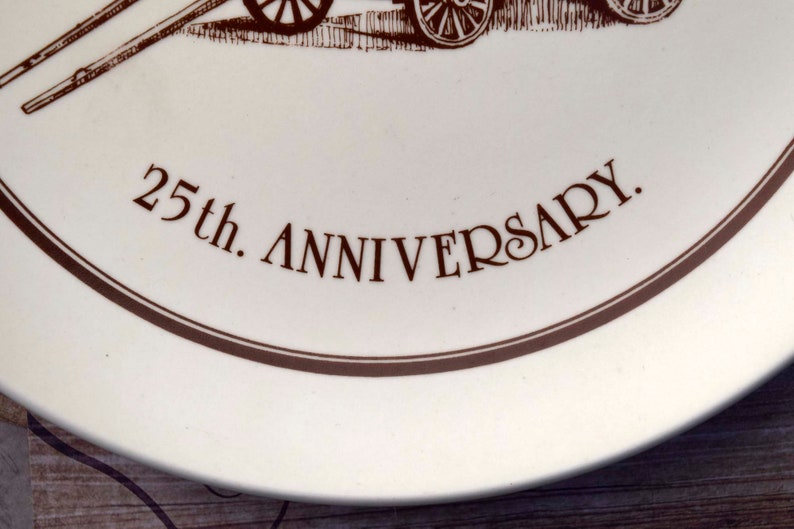
Identify the location of plate. The height and width of the screenshot is (529, 794). (272, 428).